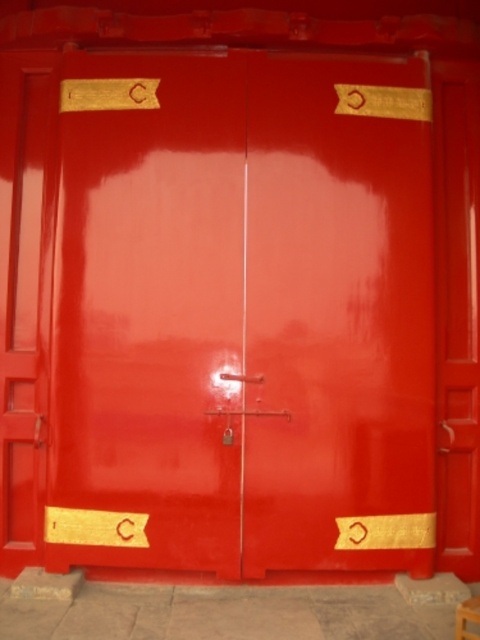
Question: Which of the following is the farthest from the observer?

Choices:
 (A) (474, 628)
 (B) (244, 541)

Answer: (B)

Question: Is glossy red door at center positioned behind wooden stool at lower right?

Choices:
 (A) no
 (B) yes

Answer: (B)

Question: Does glossy red door at center have a smaller size compared to wooden stool at lower right?

Choices:
 (A) yes
 (B) no

Answer: (B)

Question: Which of the following is the farthest from the observer?

Choices:
 (A) (478, 602)
 (B) (144, 140)

Answer: (B)

Question: Is glossy red door at center closer to the viewer compared to wooden stool at lower right?

Choices:
 (A) yes
 (B) no

Answer: (B)